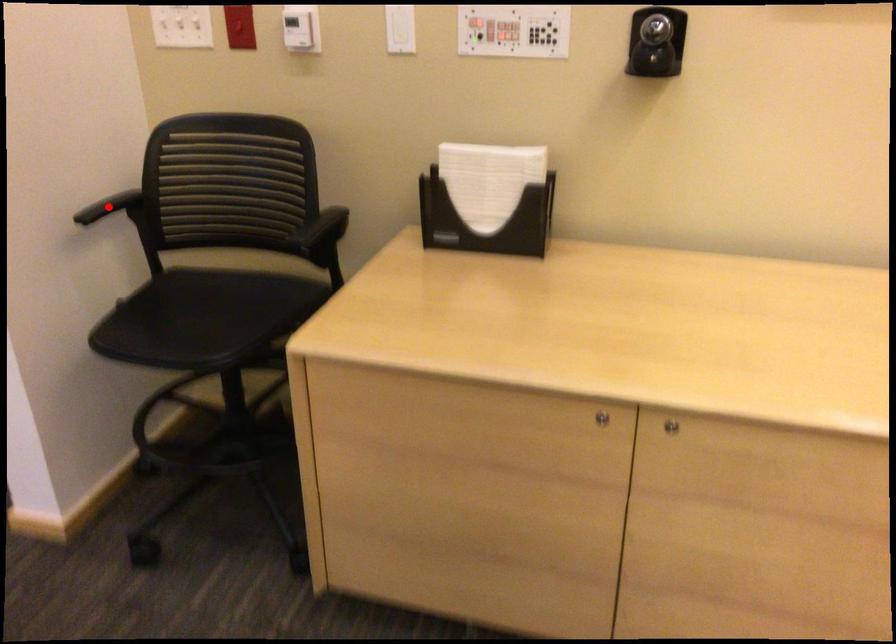
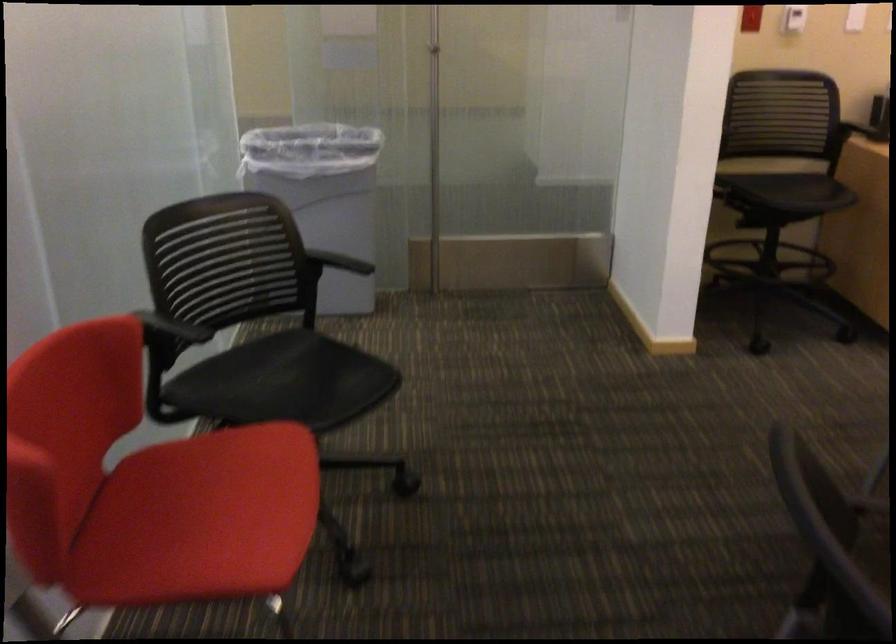
Question: I am providing you with two images of the same scene from different viewpoints. A red point is marked on the first image. Is the red point's position out of view in image 2?

Choices:
 (A) Yes
 (B) No

Answer: (A)